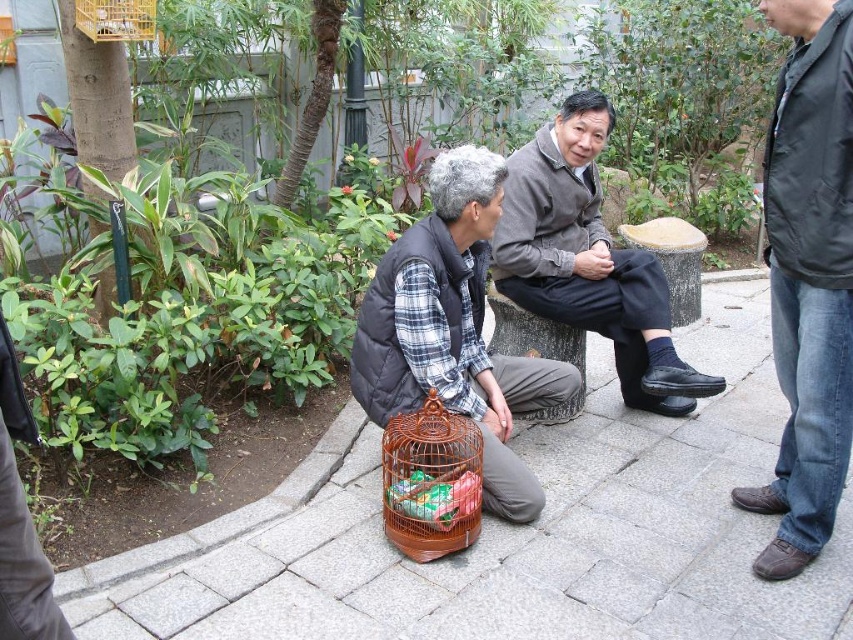
Question: Is brown wire birdcage at lower center below wooden birdcage at upper left?

Choices:
 (A) yes
 (B) no

Answer: (A)

Question: Which object is positioned farthest from the black matte jacket at right?

Choices:
 (A) gray wool sweater at center
 (B) brown woven birdcage at lower center
 (C) wooden birdcage at upper left

Answer: (C)

Question: Is gray wool sweater at center bigger than wooden birdcage at upper left?

Choices:
 (A) yes
 (B) no

Answer: (A)

Question: Which is farther from the black matte jacket at right?

Choices:
 (A) gray wool sweater at center
 (B) brown wire birdcage at lower center
 (C) wooden birdcage at upper left
 (D) brown woven birdcage at lower center

Answer: (C)

Question: Based on their relative distances, which object is farther from the black matte jacket at right?

Choices:
 (A) gray wool sweater at center
 (B) brown wire birdcage at lower center

Answer: (B)

Question: Can you confirm if brown wire birdcage at lower center is positioned to the left of brown woven birdcage at lower center?

Choices:
 (A) yes
 (B) no

Answer: (B)